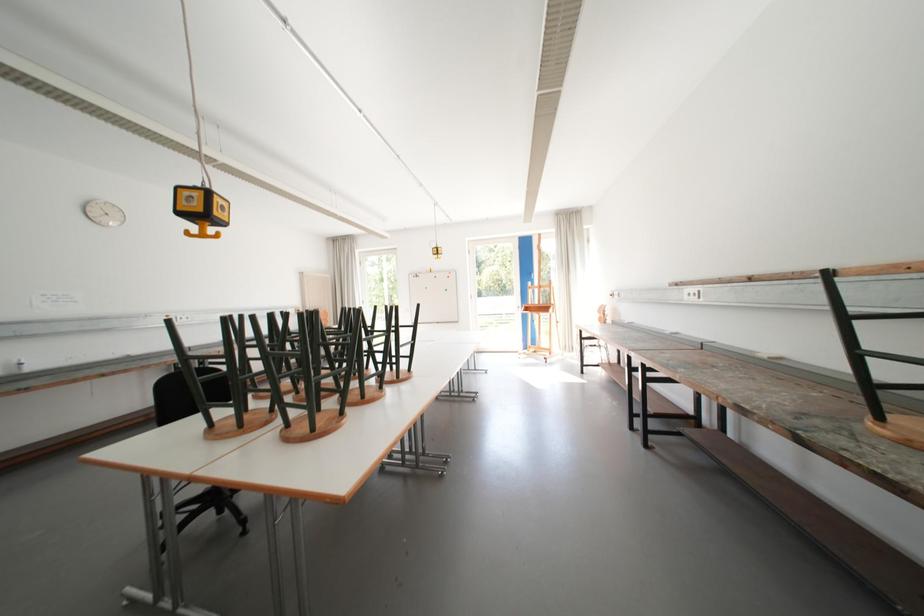
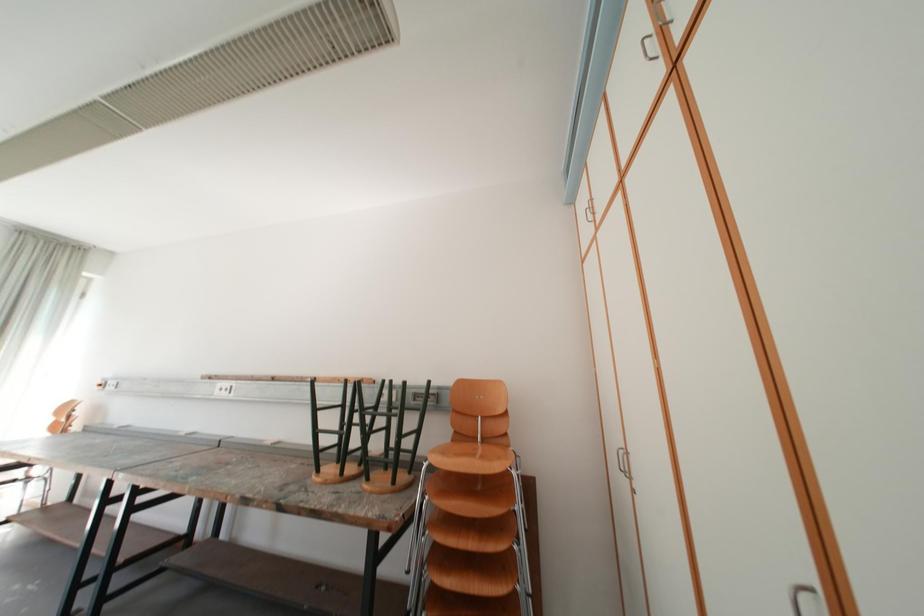
The first image is from the beginning of the video and the second image is from the end. How did the camera likely rotate when shooting the video?

The camera rotated toward right-up.